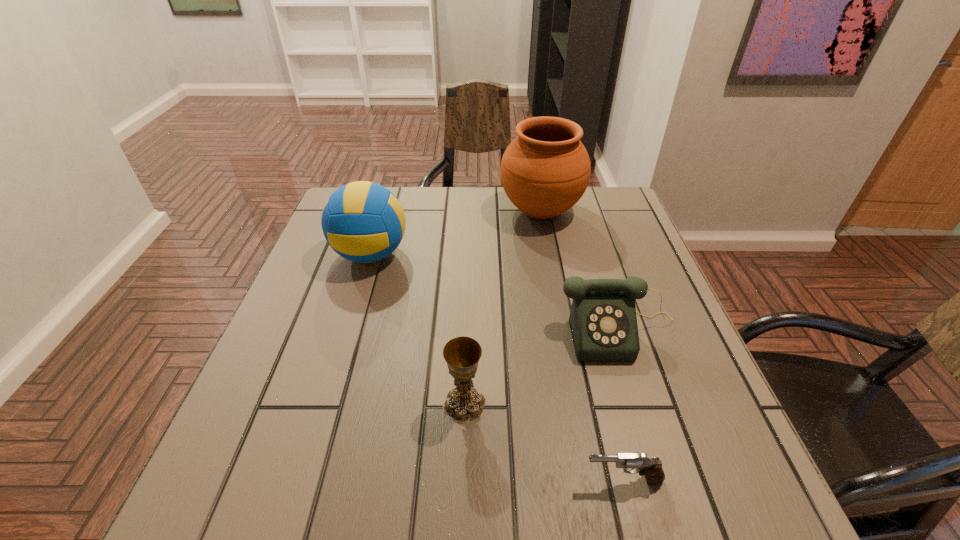
Locate an element on the screen. This screenshot has height=540, width=960. telephone located at the right edge is located at coordinates (603, 322).

Find the location of a particular element. The image size is (960, 540). pistol at the right edge is located at coordinates (651, 467).

Find the location of `object situated at the far right corner`. object situated at the far right corner is located at coordinates (545, 170).

At what (x,y) coordinates should I click in order to perform the action: click on object present at the near right corner. Please return your answer as a coordinate pair (x, y). Looking at the image, I should click on (651, 467).

Identify the location of free space at the far edge. (484, 191).

In the image, there is a desktop. At what (x,y) coordinates should I click in order to perform the action: click on free space at the near edge. Please return your answer as a coordinate pair (x, y). This screenshot has width=960, height=540. Looking at the image, I should click on (580, 511).

Identify the location of blank space at the left edge of the desktop. (295, 316).

In the image, there is a desktop. Where is `vacant area at the right edge`? This screenshot has height=540, width=960. vacant area at the right edge is located at coordinates (673, 370).

In order to click on free location at the near left corner of the desktop in this screenshot , I will do `click(222, 503)`.

In the image, there is a desktop. Where is `vacant space at the far right corner`? Image resolution: width=960 pixels, height=540 pixels. vacant space at the far right corner is located at coordinates (608, 200).